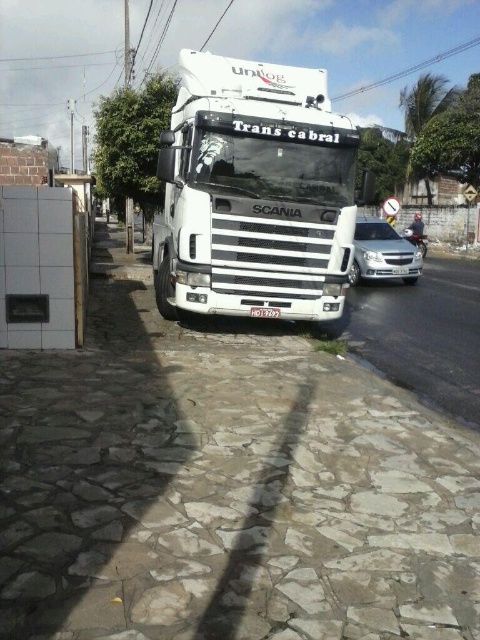
Is white matte truck at center further to the viewer compared to silver metallic sedan at right?

No, white matte truck at center is in front of silver metallic sedan at right.

This screenshot has height=640, width=480. What do you see at coordinates (253, 193) in the screenshot?
I see `white matte truck at center` at bounding box center [253, 193].

The height and width of the screenshot is (640, 480). I want to click on white matte truck at center, so click(x=253, y=193).

Who is higher up, white matte truck at center or white plastic license plate at center?

white matte truck at center is above.

In the scene shown: Does white matte truck at center have a lesser height compared to white plastic license plate at center?

No.

Between point (212, 280) and point (276, 316), which one is positioned in front?

Point (212, 280) is more forward.

The width and height of the screenshot is (480, 640). In order to click on white matte truck at center in this screenshot , I will do `click(253, 193)`.

The width and height of the screenshot is (480, 640). Describe the element at coordinates (383, 253) in the screenshot. I see `silver metallic sedan at right` at that location.

This screenshot has width=480, height=640. Find the location of `silver metallic sedan at right`. silver metallic sedan at right is located at coordinates (383, 253).